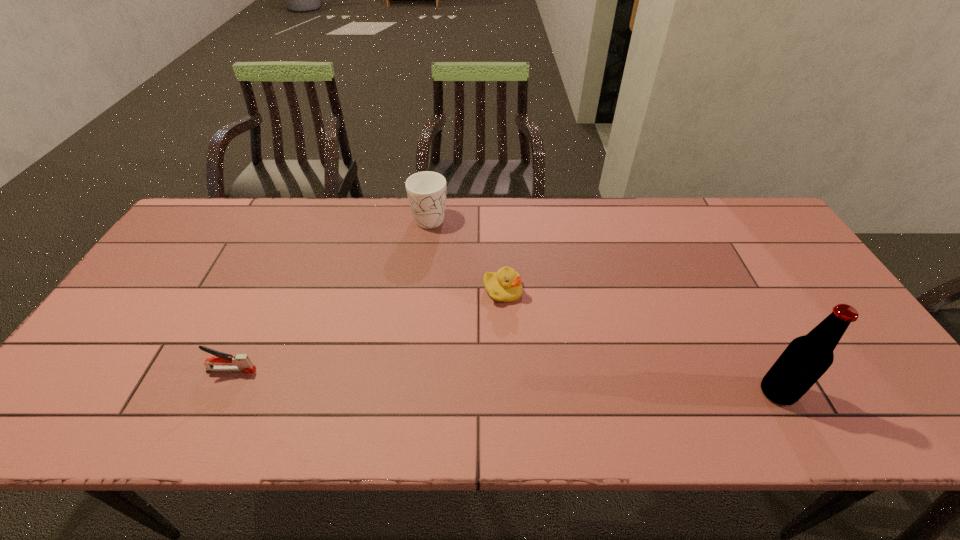
Where is `vacant space at the near edge of the desktop`? This screenshot has height=540, width=960. vacant space at the near edge of the desktop is located at coordinates (526, 362).

Where is `free region at the right edge of the desktop`? The image size is (960, 540). free region at the right edge of the desktop is located at coordinates (788, 277).

Where is `vacant space at the far left corner of the desktop`? The width and height of the screenshot is (960, 540). vacant space at the far left corner of the desktop is located at coordinates pos(220,200).

In the image, there is a desktop. Where is `free space at the far right corner`? The height and width of the screenshot is (540, 960). free space at the far right corner is located at coordinates (743, 222).

The height and width of the screenshot is (540, 960). Identify the location of empty space that is in between the third farthest object and the third nearest object. (367, 331).

Locate an element on the screen. unoccupied position between the duckling and the mug is located at coordinates (467, 254).

Identify the location of vacant area that lies between the nearest object and the leftmost object. The image size is (960, 540). (504, 381).

Find the location of a particular element. unoccupied area between the second nearest object and the second object from left to right is located at coordinates (330, 293).

Identify the location of blank region between the farthest object and the stapler. (330, 293).

Image resolution: width=960 pixels, height=540 pixels. I want to click on unoccupied position between the nearest object and the duckling, so click(x=640, y=342).